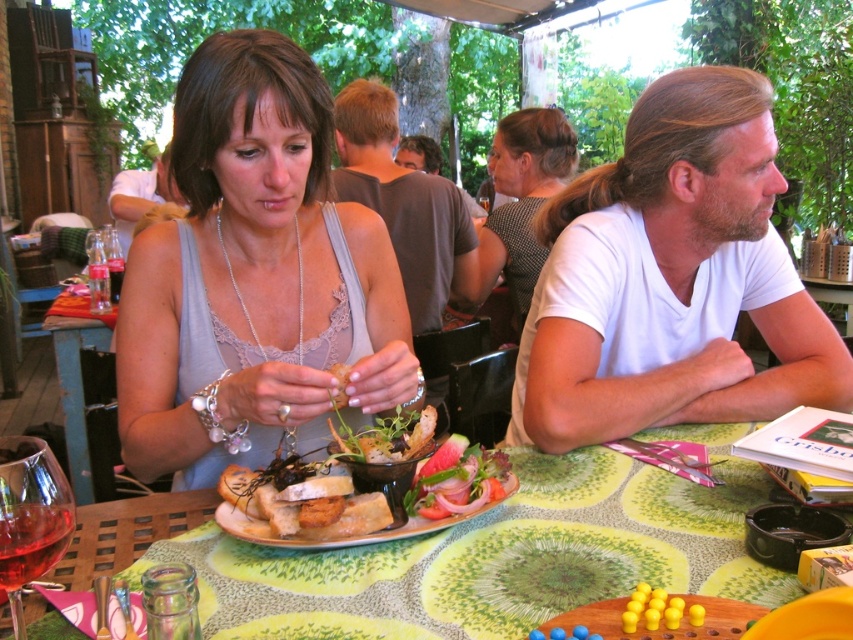
Is point (396, 419) less distant than point (334, 406)?

No, it is not.

Between point (399, 456) and point (347, 372), which one is positioned behind?

Point (347, 372)

Locate an element on the screen. The width and height of the screenshot is (853, 640). matte brown bread at center is located at coordinates (387, 438).

Does gray cotton shirt at center have a larger size compared to dark brown shirt at center?

Indeed, gray cotton shirt at center has a larger size compared to dark brown shirt at center.

Who is taller, gray cotton shirt at center or dark brown shirt at center?

gray cotton shirt at center

Which is behind, point (416, 285) or point (431, 170)?

Point (431, 170)

Identify the location of gray cotton shirt at center. The width and height of the screenshot is (853, 640). (404, 204).

Between green fabric tablecloth at center and dark gray textured shirt at upper center, which one appears on the right side from the viewer's perspective?

dark gray textured shirt at upper center

Who is more forward, [517,618] or [523,308]?

Positioned in front is point [517,618].

The height and width of the screenshot is (640, 853). In order to click on green fabric tablecloth at center in this screenshot , I will do `click(500, 554)`.